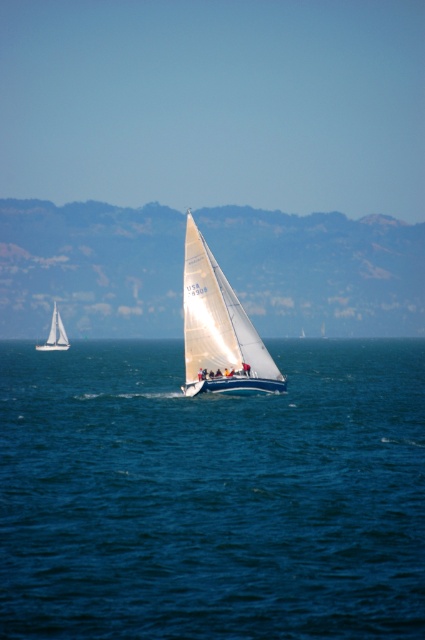
You are an observer standing on the deck of the white matte sailboat at center. You notice another white matte sailboat at left in the distance. Based on the scene, which sailboat appears taller from your perspective?

The white matte sailboat at left appears taller because the white matte sailboat at center has a lesser height compared to the white matte sailboat at left from your perspective.

Looking at this image, you are a sailor on the white matte sailboat at center and want to dock at a pier that can only accommodate boats up to the width of the white matte sailboat at left. Can your boat fit?

The white matte sailboat at center has a width less than the white matte sailboat at left, so yes, the boat can fit.

What is the position of the white matte sailboat at center relative to the white matte sailboat at left?

The white matte sailboat at center is positioned to the right of the white matte sailboat at left.